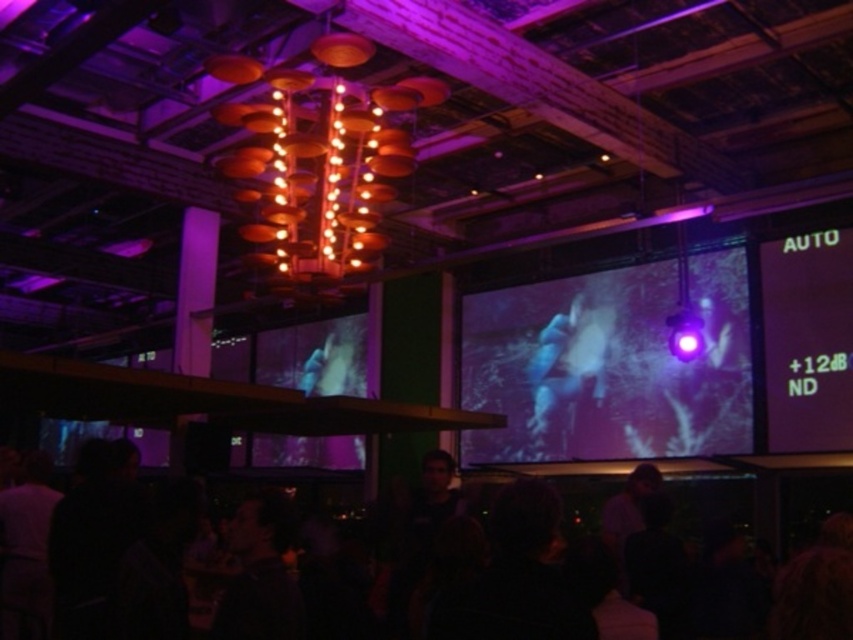
You are a photographer planning to capture the entire scene of the nightclub. You notice the matte black screen at center and the black matte crowd at lower center. Which object has a wider width in the image?

The black matte crowd at lower center has a wider width than the matte black screen at center.